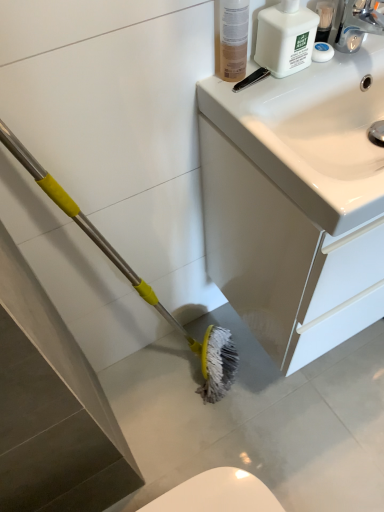
Question: Is translucent plastic bottle at upper right far from white glossy sink at upper right?

Choices:
 (A) no
 (B) yes

Answer: (A)

Question: Can you confirm if translucent plastic bottle at upper right is wider than white glossy sink at upper right?

Choices:
 (A) no
 (B) yes

Answer: (A)

Question: Would you say white glossy sink at upper right is part of translucent plastic bottle at upper right's contents?

Choices:
 (A) no
 (B) yes

Answer: (A)

Question: Is translucent plastic bottle at upper right thinner than white glossy sink at upper right?

Choices:
 (A) no
 (B) yes

Answer: (B)

Question: Could you tell me if translucent plastic bottle at upper right is facing white glossy sink at upper right?

Choices:
 (A) no
 (B) yes

Answer: (A)

Question: From the image's perspective, does translucent plastic bottle at upper right appear lower than white glossy sink at upper right?

Choices:
 (A) no
 (B) yes

Answer: (A)

Question: Is white plastic bottle at upper right thinner than white glossy sink at upper right?

Choices:
 (A) yes
 (B) no

Answer: (A)

Question: Is white plastic bottle at upper right further to the viewer compared to white glossy sink at upper right?

Choices:
 (A) yes
 (B) no

Answer: (A)

Question: Is white plastic bottle at upper right to the left of white glossy sink at upper right from the viewer's perspective?

Choices:
 (A) no
 (B) yes

Answer: (B)

Question: From a real-world perspective, is white plastic bottle at upper right on white glossy sink at upper right?

Choices:
 (A) no
 (B) yes

Answer: (B)

Question: Does white plastic bottle at upper right have a greater height compared to white glossy sink at upper right?

Choices:
 (A) no
 (B) yes

Answer: (A)

Question: From a real-world perspective, is white plastic bottle at upper right beneath white glossy sink at upper right?

Choices:
 (A) no
 (B) yes

Answer: (A)

Question: From the image's perspective, does translucent plastic bottle at upper right appear lower than white plastic bottle at upper right?

Choices:
 (A) yes
 (B) no

Answer: (A)